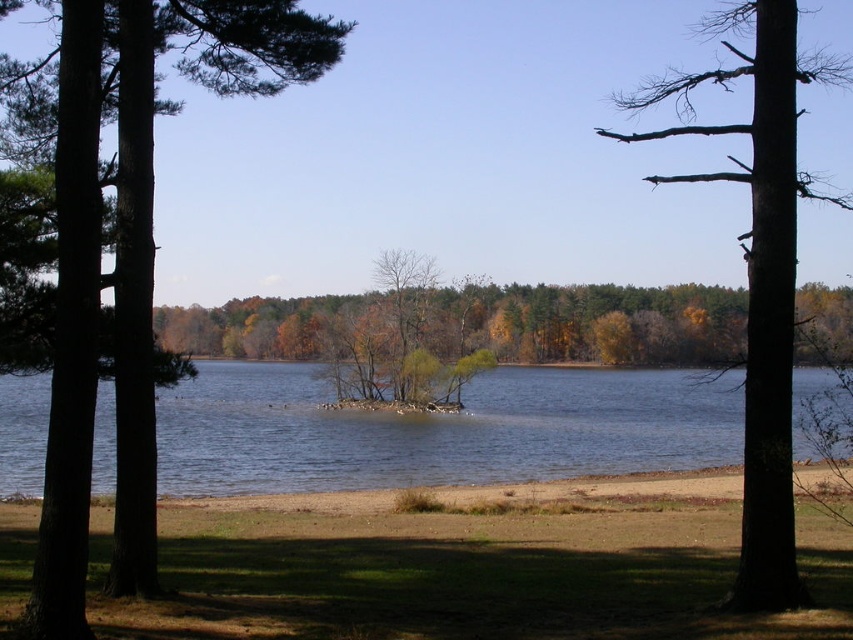
You are standing at the lakeside and notice the green matte tree at left and the clear blue water at center. Which object is taller?

The green matte tree at left is taller than the clear blue water at center.

You are standing at the lakeside and want to take a photo of the clear blue water at center and the brown rough bark tree at right. Which object should you focus on first if you want both to be in sharp focus?

The clear blue water at center is in front of the brown rough bark tree at right, so you should focus on the brown rough bark tree at right first to ensure both are in focus.